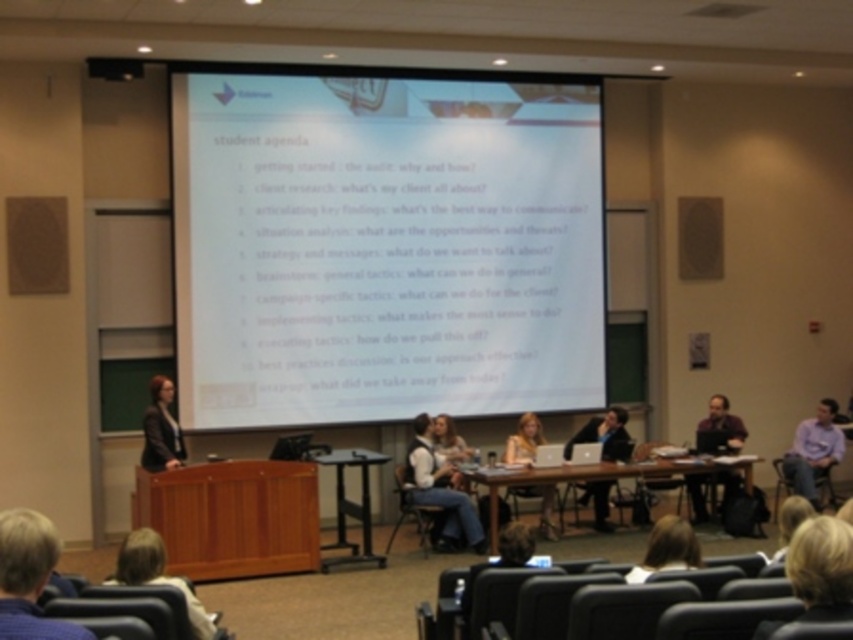
Which is more to the right, blonde hair at lower right or purple matte shirt at lower right?

Positioned to the right is purple matte shirt at lower right.

Is blonde hair at lower right taller than purple matte shirt at lower right?

In fact, blonde hair at lower right may be shorter than purple matte shirt at lower right.

Find the location of a particular element. This screenshot has width=853, height=640. blonde hair at lower right is located at coordinates (666, 548).

Can you confirm if wooden table at center is shorter than blonde hair at center?

In fact, wooden table at center may be taller than blonde hair at center.

Is wooden table at center thinner than blonde hair at center?

No.

The width and height of the screenshot is (853, 640). Find the location of `wooden table at center`. wooden table at center is located at coordinates (598, 476).

Between point (576, 176) and point (152, 401), which one is positioned in front?

Point (152, 401) is in front.

Consider the image. Is white matte projector screen at upper center taller than matte black blazer at left?

Correct, white matte projector screen at upper center is much taller as matte black blazer at left.

This screenshot has height=640, width=853. What are the coordinates of `white matte projector screen at upper center` in the screenshot? It's located at (384, 248).